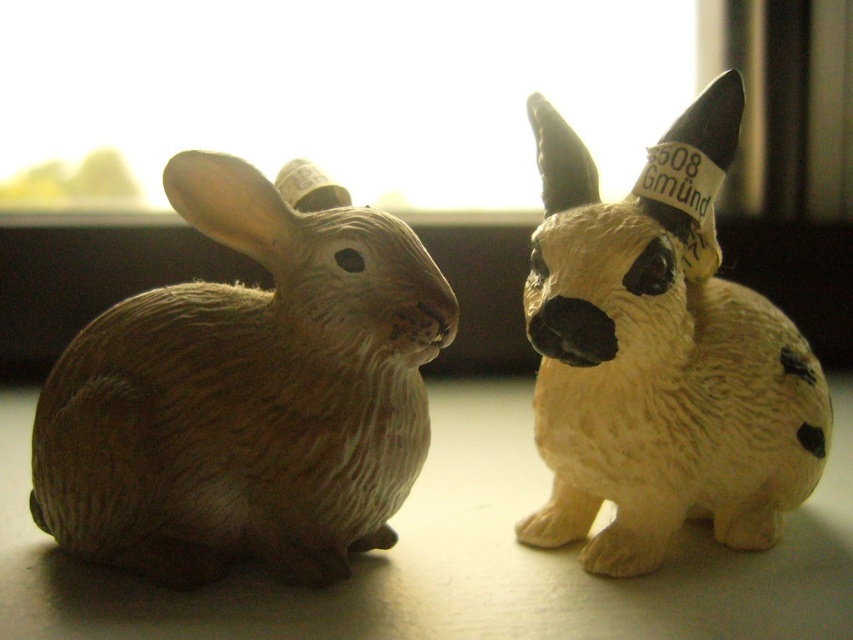
Describe the element at coordinates (248, 388) in the screenshot. The image size is (853, 640). I see `matte brown rabbit at left` at that location.

Who is higher up, matte brown rabbit at left or matte beige rabbit at right?

matte beige rabbit at right is higher up.

The height and width of the screenshot is (640, 853). Describe the element at coordinates (248, 388) in the screenshot. I see `matte brown rabbit at left` at that location.

You are a GUI agent. You are given a task and a screenshot of the screen. Output one action in this format:
    pyautogui.click(x=<x>, y=<y>)
    Task: Click on the matte brown rabbit at left
    This screenshot has height=640, width=853.
    Given the screenshot: What is the action you would take?
    pyautogui.click(x=248, y=388)